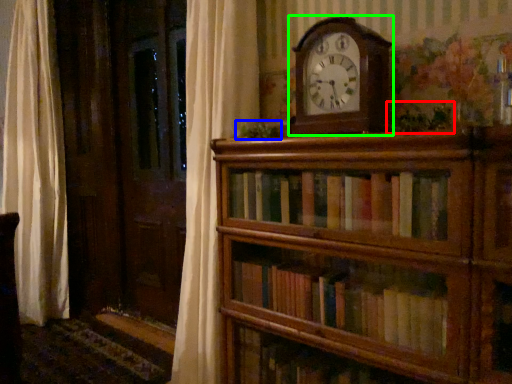
Question: Which object is positioned closest to plant (highlighted by a red box)? Select from plant (highlighted by a blue box) and wall clock (highlighted by a green box).

Choices:
 (A) plant
 (B) wall clock

Answer: (B)